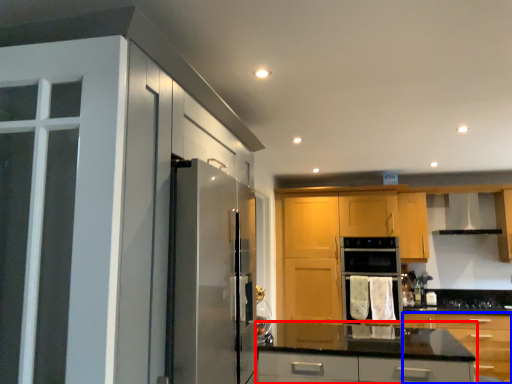
Question: Which point is further to the camera, cabinetry (highlighted by a red box) or cabinetry (highlighted by a blue box)?

Choices:
 (A) cabinetry
 (B) cabinetry

Answer: (A)